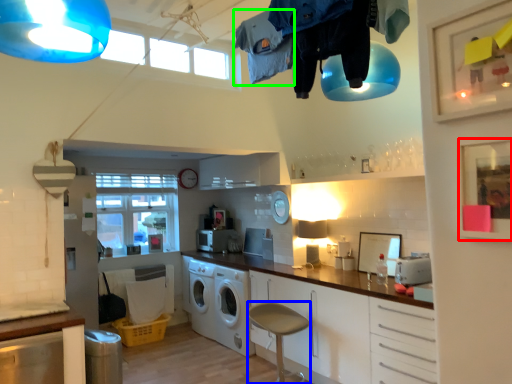
Question: Considering the real-world distances, which object is closest to picture frame (highlighted by a red box)? bar stool (highlighted by a blue box) or clothing (highlighted by a green box).

Choices:
 (A) bar stool
 (B) clothing

Answer: (B)